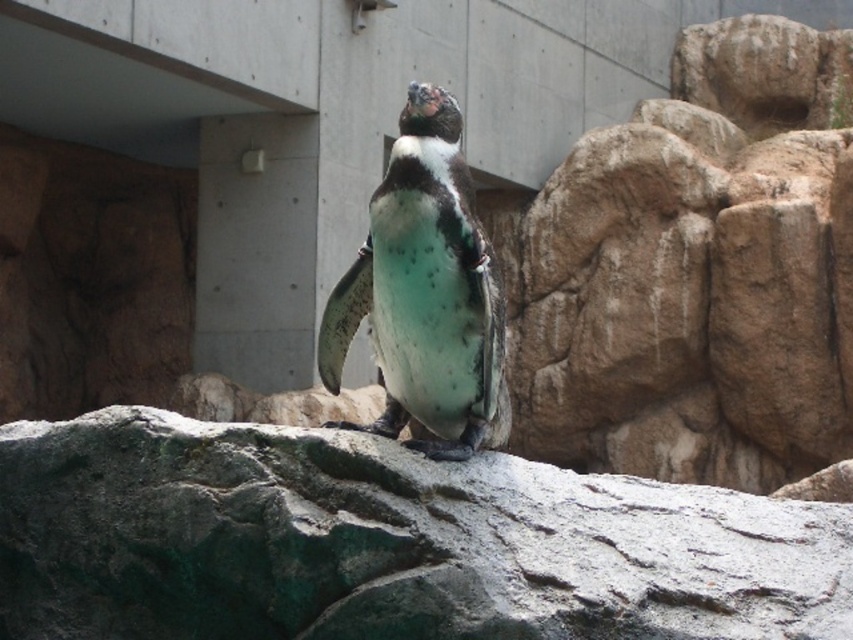
Question: Does green stone at center have a greater width compared to green speckled penguin at center?

Choices:
 (A) no
 (B) yes

Answer: (B)

Question: Which is nearer to the green stone at center?

Choices:
 (A) bumpy brown rock at right
 (B) green speckled penguin at center

Answer: (B)

Question: Does green stone at center have a greater width compared to green speckled penguin at center?

Choices:
 (A) no
 (B) yes

Answer: (B)

Question: Among these objects, which one is farthest from the camera?

Choices:
 (A) bumpy brown rock at right
 (B) green stone at center

Answer: (A)

Question: Does green stone at center appear on the left side of bumpy brown rock at right?

Choices:
 (A) no
 (B) yes

Answer: (B)

Question: Which point is closer to the camera taking this photo?

Choices:
 (A) (619, 256)
 (B) (494, 436)

Answer: (B)